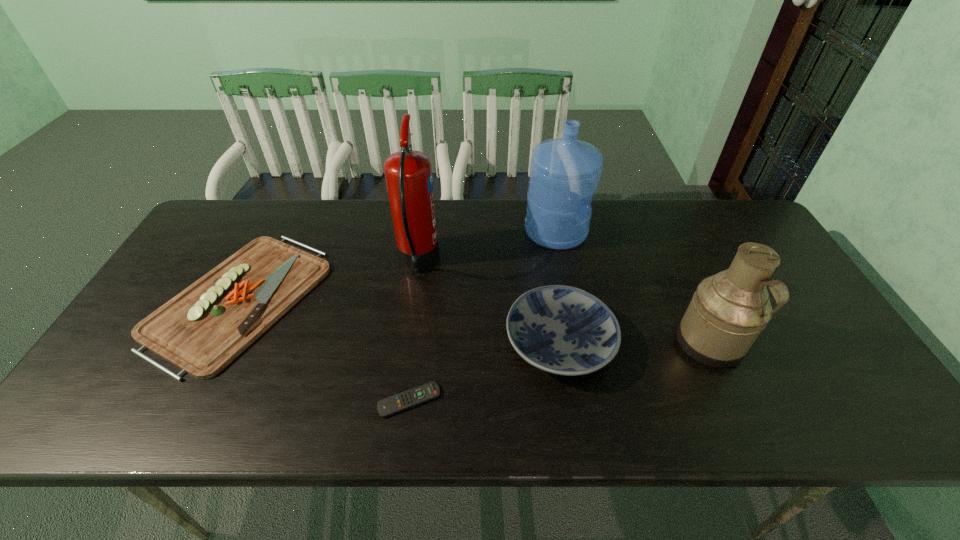
Where is `fire extinguisher`? This screenshot has height=540, width=960. fire extinguisher is located at coordinates 408,173.

You are a GUI agent. You are given a task and a screenshot of the screen. Output one action in this format:
    pyautogui.click(x=<x>, y=<y>)
    Task: Click on the water jug
    Image resolution: width=960 pixels, height=540 pixels.
    Given the screenshot: What is the action you would take?
    pyautogui.click(x=564, y=172)

Identify the location of the third tallest object. (728, 311).

Identify the location of pitcher. The image size is (960, 540). (728, 311).

What are the coordinates of `plate` in the screenshot? It's located at (563, 330).

Find the location of a particular element. The height and width of the screenshot is (540, 960). chopping board is located at coordinates (201, 330).

Where is `the leftmost object`? the leftmost object is located at coordinates (201, 330).

The image size is (960, 540). What are the coordinates of `the shortest object` in the screenshot? It's located at (391, 405).

Locate an element on the screen. blank space located on the surface of the fire extinguisher is located at coordinates (557, 260).

Where is `free spot located on the side of the water jug with the handle`? This screenshot has width=960, height=540. free spot located on the side of the water jug with the handle is located at coordinates (657, 231).